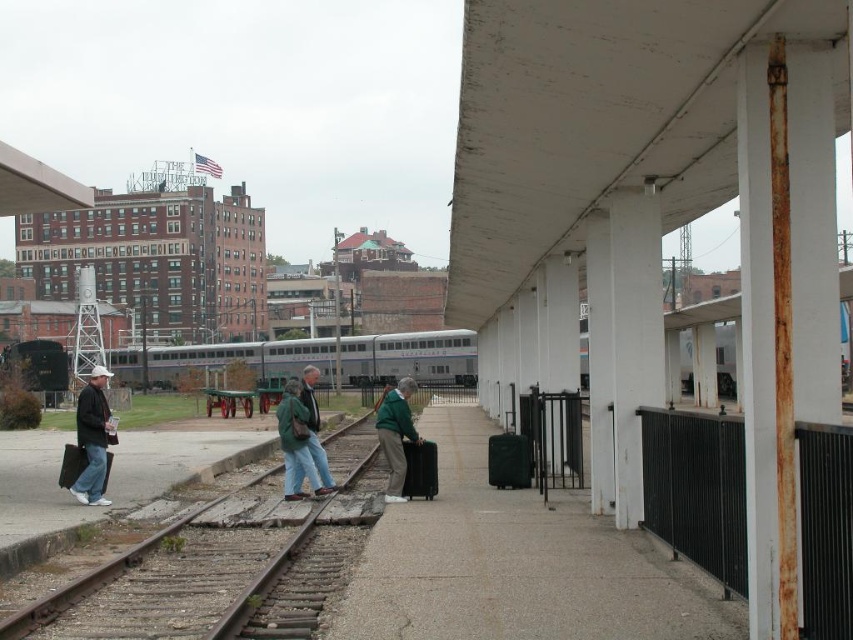
Question: Observing the image, what is the correct spatial positioning of rusty metal train track at lower left in reference to dark brown leather jacket at left?

Choices:
 (A) below
 (B) above

Answer: (A)

Question: Which point is closer to the camera?

Choices:
 (A) green fabric jacket at center
 (B) matte black suitcase at center

Answer: (A)

Question: Estimate the real-world distances between objects in this image. Which object is farther from the matte black suitcase at center?

Choices:
 (A) black matte suitcase at center
 (B) silver metallic train at center
 (C) green fabric jacket at center

Answer: (B)

Question: Can you confirm if silver metallic train at center is positioned above green fabric jacket at center?

Choices:
 (A) no
 (B) yes

Answer: (B)

Question: Among these objects, which one is farthest from the camera?

Choices:
 (A) dark brown leather jacket at left
 (B) green wool jacket at center
 (C) matte black suitcase at left
 (D) matte black suitcase at center

Answer: (D)

Question: Is the position of green wool jacket at center less distant than that of black matte suitcase at center?

Choices:
 (A) no
 (B) yes

Answer: (B)